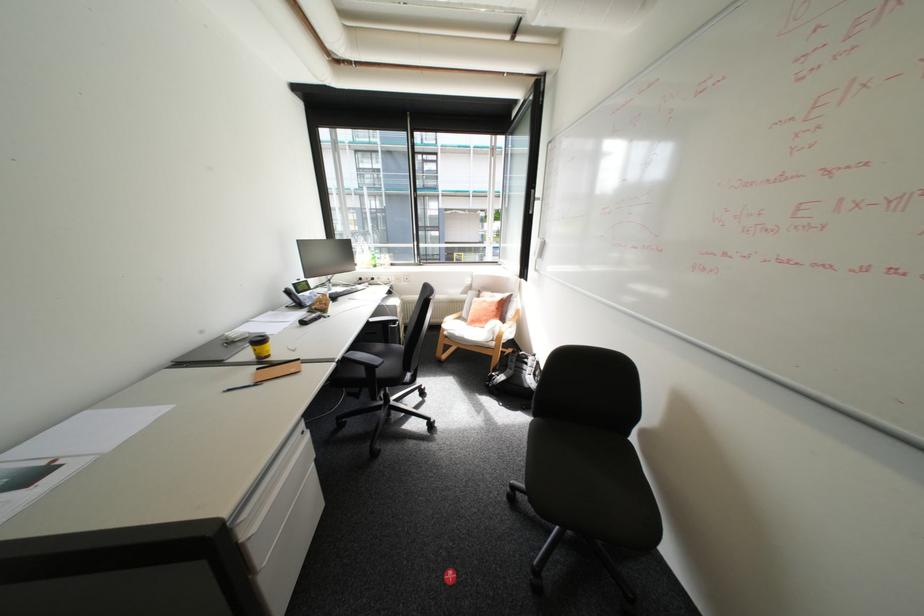
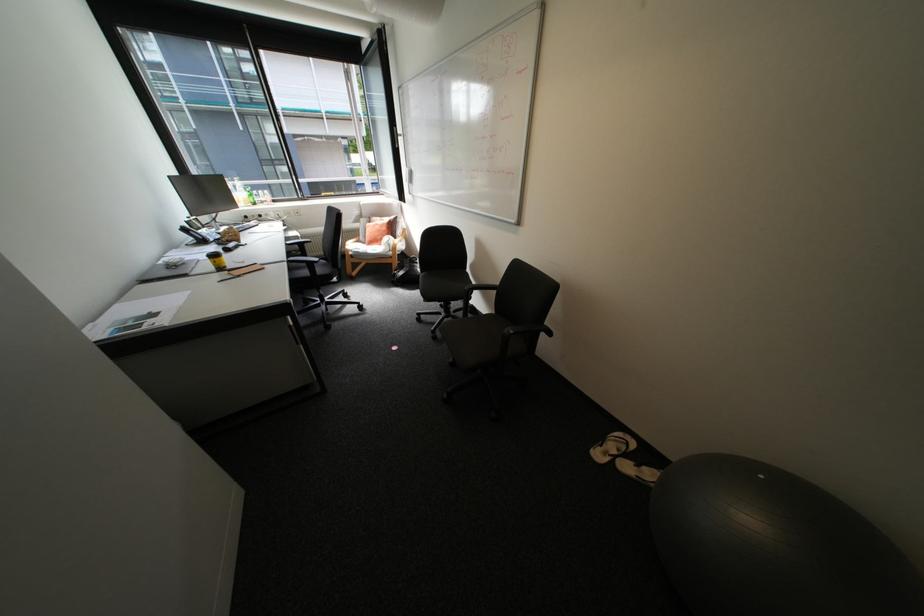
The point at (297, 292) is marked in the first image. Where is the corresponding point in the second image?

(195, 230)